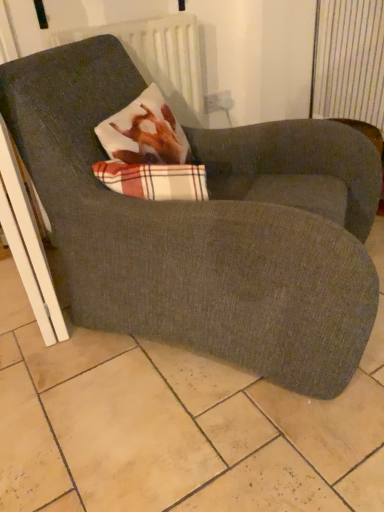
This screenshot has height=512, width=384. Describe the element at coordinates (159, 58) in the screenshot. I see `white textured radiator at upper center` at that location.

Measure the distance between white textured radiator at upper center and camera.

white textured radiator at upper center is 5.12 feet from camera.

In order to face white textured radiator at upper center, should I rotate leftwards or rightwards?

Rotate left and turn 7.623 degrees.

Locate an element on the screen. white textured radiator at upper center is located at coordinates (159, 58).

What do you see at coordinates (206, 226) in the screenshot? I see `dark gray fabric chair at center` at bounding box center [206, 226].

At what (x,y) coordinates should I click in order to perform the action: click on dark gray fabric chair at center. Please return your answer as a coordinate pair (x, y). The image size is (384, 512). Looking at the image, I should click on (206, 226).

At what (x,y) coordinates should I click in order to perform the action: click on white textured radiator at upper center. Please return your answer as a coordinate pair (x, y). The image size is (384, 512). Looking at the image, I should click on (159, 58).

Considering the relative positions of white textured radiator at upper center and dark gray fabric chair at center in the image provided, is white textured radiator at upper center to the left of dark gray fabric chair at center from the viewer's perspective?

Indeed, white textured radiator at upper center is positioned on the left side of dark gray fabric chair at center.

Which is behind, white textured radiator at upper center or dark gray fabric chair at center?

white textured radiator at upper center is behind.

Which is behind, point (174, 37) or point (90, 229)?

Positioned behind is point (174, 37).

From the image's perspective, is white textured radiator at upper center above or below dark gray fabric chair at center?

Based on their image positions, white textured radiator at upper center is located above dark gray fabric chair at center.

From a real-world perspective, is white textured radiator at upper center physically above dark gray fabric chair at center?

Yes, from a real-world perspective, white textured radiator at upper center is above dark gray fabric chair at center.

Can you confirm if white textured radiator at upper center is thinner than dark gray fabric chair at center?

Yes, white textured radiator at upper center is thinner than dark gray fabric chair at center.

Between white textured radiator at upper center and dark gray fabric chair at center, which one has more height?

With more height is dark gray fabric chair at center.

Who is smaller, white textured radiator at upper center or dark gray fabric chair at center?

With smaller size is white textured radiator at upper center.

Is dark gray fabric chair at center located within white textured radiator at upper center?

No, dark gray fabric chair at center is not a part of white textured radiator at upper center.

Are white textured radiator at upper center and dark gray fabric chair at center located far from each other?

Actually, white textured radiator at upper center and dark gray fabric chair at center are a little close together.

Is white textured radiator at upper center oriented away from dark gray fabric chair at center?

No, white textured radiator at upper center is not facing away from dark gray fabric chair at center.

How many degrees apart are the facing directions of white textured radiator at upper center and dark gray fabric chair at center?

There is a 37.1-degree angle between the facing directions of white textured radiator at upper center and dark gray fabric chair at center.

I want to click on radiator that appears behind the dark gray fabric chair at center, so click(159, 58).

Considering the positions of objects dark gray fabric chair at center and white textured radiator at upper center in the image provided, who is more to the right, dark gray fabric chair at center or white textured radiator at upper center?

dark gray fabric chair at center.

Considering their positions, is dark gray fabric chair at center located in front of or behind white textured radiator at upper center?

dark gray fabric chair at center is positioned closer to the viewer than white textured radiator at upper center.

Is point (335, 281) in front of point (181, 84)?

Yes, point (335, 281) is in front of point (181, 84).

From the image's perspective, which is below, dark gray fabric chair at center or white textured radiator at upper center?

dark gray fabric chair at center is shown below in the image.

From a real-world perspective, between dark gray fabric chair at center and white textured radiator at upper center, who is vertically lower?

dark gray fabric chair at center, from a real-world perspective.

Based on the photo, considering the sizes of dark gray fabric chair at center and white textured radiator at upper center in the image, is dark gray fabric chair at center wider or thinner than white textured radiator at upper center?

dark gray fabric chair at center is wider than white textured radiator at upper center.

Considering the sizes of objects dark gray fabric chair at center and white textured radiator at upper center in the image provided, who is taller, dark gray fabric chair at center or white textured radiator at upper center?

dark gray fabric chair at center.

Between dark gray fabric chair at center and white textured radiator at upper center, which one has larger size?

dark gray fabric chair at center is bigger.

In the scene shown: Is dark gray fabric chair at center not inside white textured radiator at upper center?

Absolutely, dark gray fabric chair at center is external to white textured radiator at upper center.

Is dark gray fabric chair at center in contact with white textured radiator at upper center?

No.

Is dark gray fabric chair at center oriented away from white textured radiator at upper center?

No.

What's the angular difference between dark gray fabric chair at center and white textured radiator at upper center's facing directions?

The angle between the facing direction of dark gray fabric chair at center and the facing direction of white textured radiator at upper center is 37.1 degrees.

I want to click on radiator that appears above the dark gray fabric chair at center (from a real-world perspective), so click(x=159, y=58).

Where is `chair in front of the white textured radiator at upper center`? The image size is (384, 512). chair in front of the white textured radiator at upper center is located at coordinates (206, 226).

Locate an element on the screen. This screenshot has width=384, height=512. chair lying below the white textured radiator at upper center (from the image's perspective) is located at coordinates (206, 226).